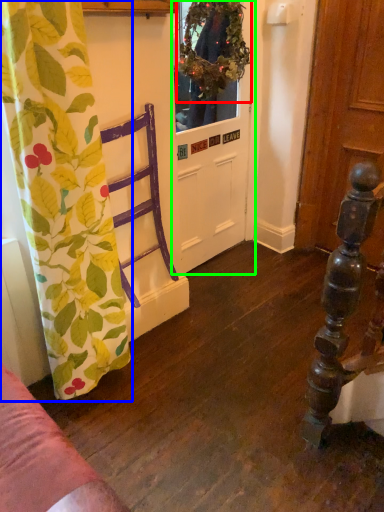
Question: Which object is the farthest from floral arrangement (highlighted by a red box)? Choose among these: curtain (highlighted by a blue box) or door (highlighted by a green box).

Choices:
 (A) curtain
 (B) door

Answer: (A)